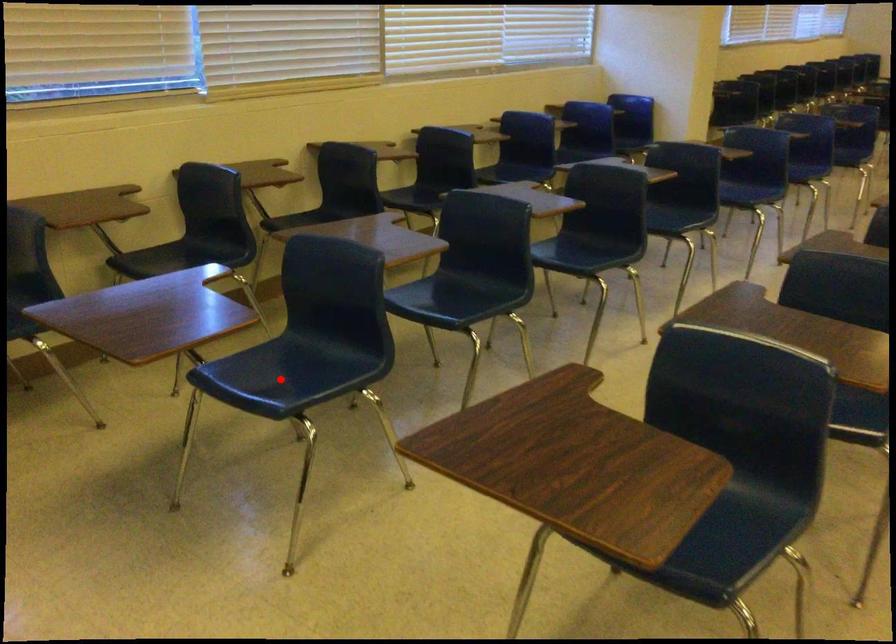
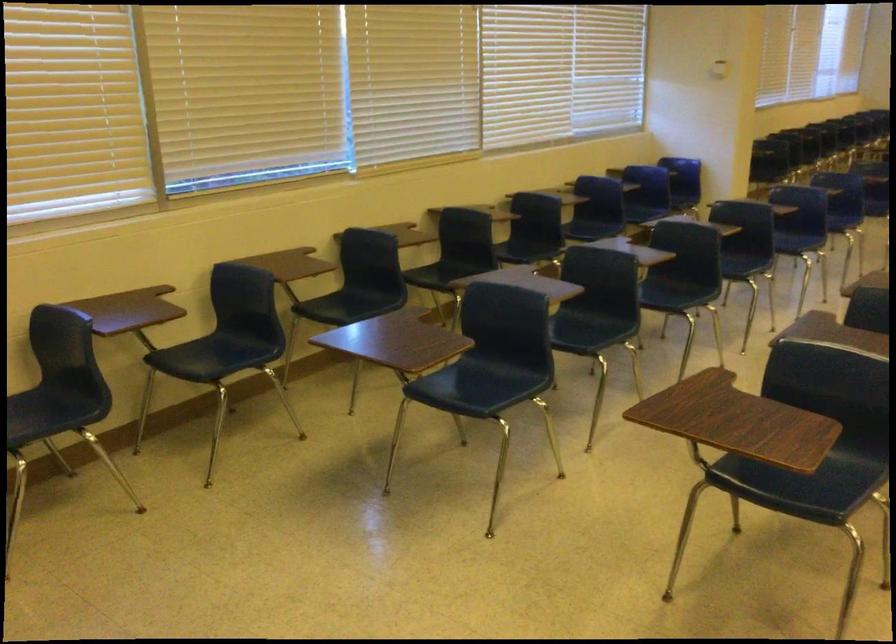
Question: A red point is marked in image1. In image2, is the corresponding 3D point closer to the camera or farther? Reply with the corresponding letter.

Choices:
 (A) The corresponding 3D point is closer.
 (B) The corresponding 3D point is farther.

Answer: (B)